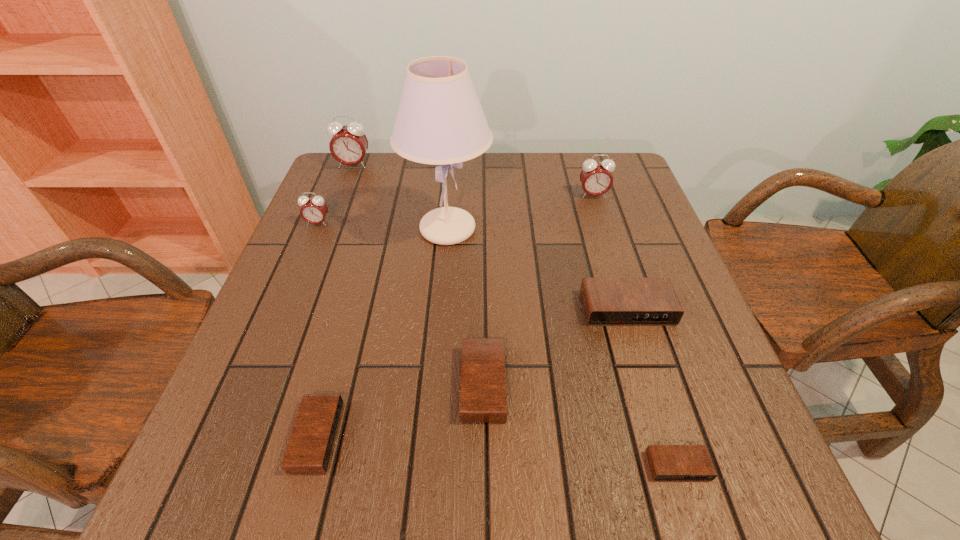
Where is `the tallest object`? the tallest object is located at coordinates (440, 121).

This screenshot has height=540, width=960. Find the location of `the farthest object`. the farthest object is located at coordinates (349, 144).

Where is `the farthest alarm clock`? The image size is (960, 540). the farthest alarm clock is located at coordinates (349, 144).

Locate an element on the screen. This screenshot has height=540, width=960. the second farthest object is located at coordinates (596, 179).

Where is `the sixth shortest alarm clock`? The image size is (960, 540). the sixth shortest alarm clock is located at coordinates (596, 179).

Where is `the third tallest alarm clock`? the third tallest alarm clock is located at coordinates (313, 210).

Identify the location of the fifth shortest object. The image size is (960, 540). (313, 210).

In order to click on the fourth tallest alarm clock in this screenshot , I will do `click(606, 301)`.

At what (x,y) coordinates should I click in order to perform the action: click on the fifth tallest object. Please return your answer as a coordinate pair (x, y). This screenshot has width=960, height=540. Looking at the image, I should click on (606, 301).

You are a GUI agent. You are given a task and a screenshot of the screen. Output one action in this format:
    pyautogui.click(x=<x>, y=<y>)
    Task: Click on the third smallest black alarm clock
    This screenshot has width=960, height=540.
    Given the screenshot: What is the action you would take?
    pyautogui.click(x=483, y=399)